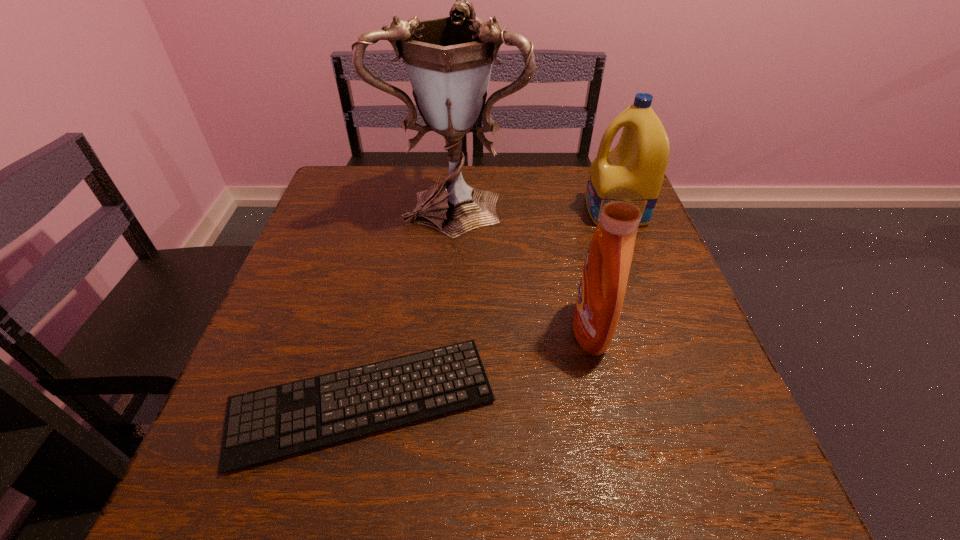
Image resolution: width=960 pixels, height=540 pixels. I want to click on the tallest object, so click(x=448, y=60).

Locate an element on the screen. This screenshot has width=960, height=540. the nearer detergent is located at coordinates (604, 278).

Where is `the second object from right to left`? the second object from right to left is located at coordinates (604, 278).

Find the location of a particular element. The image size is (960, 540). the farther detergent is located at coordinates (639, 161).

Locate an element on the screen. The height and width of the screenshot is (540, 960). the right detergent is located at coordinates [x=639, y=161].

The height and width of the screenshot is (540, 960). What are the coordinates of `the shortest object` in the screenshot? It's located at (267, 424).

Where is `vacant point located 0.120m on the front of the tallest object`? Image resolution: width=960 pixels, height=540 pixels. vacant point located 0.120m on the front of the tallest object is located at coordinates (449, 275).

You are a GUI agent. You are given a task and a screenshot of the screen. Output one action in this format:
    pyautogui.click(x=<x>, y=<y>)
    Task: Click on the free space located 0.080m on the front-facing side of the left detergent
    This screenshot has height=540, width=960.
    Given the screenshot: What is the action you would take?
    pyautogui.click(x=531, y=331)

You are a GUI agent. You are given a task and a screenshot of the screen. Output one action in this format:
    pyautogui.click(x=<x>, y=<y>)
    Task: Click on the free space located 0.370m on the front-facing side of the left detergent
    
    Given the screenshot: What is the action you would take?
    pyautogui.click(x=377, y=331)

The height and width of the screenshot is (540, 960). Find the location of `vacant space situated 0.200m on the front-facing side of the left detergent`. vacant space situated 0.200m on the front-facing side of the left detergent is located at coordinates pyautogui.click(x=468, y=331).